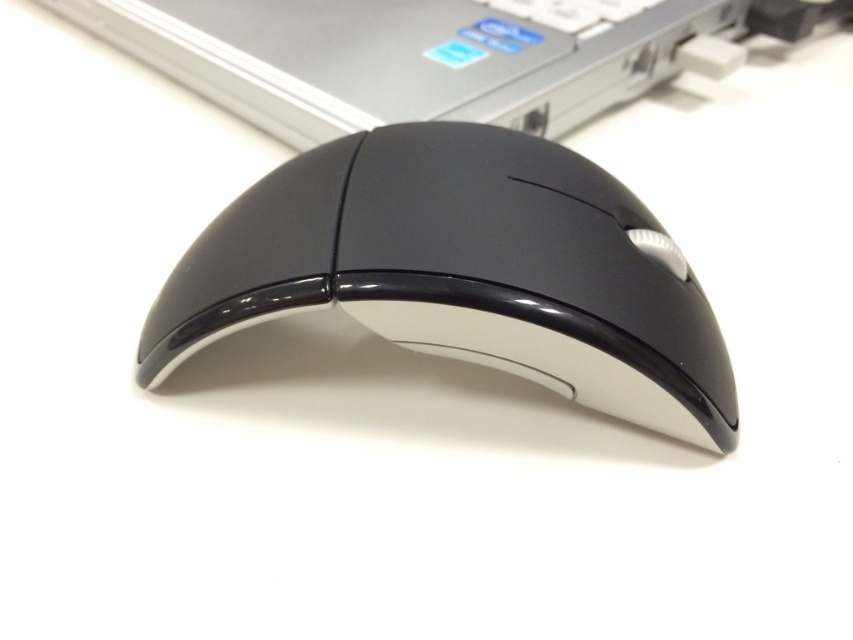
You are a graphic designer working on a project and need to place a new sticker exactly at the center of the white surface where the black glossy mouse at center is currently located. To do this, you must first determine the coordinates of the surface. However, you only have the mouse position. Can you estimate where the center of the white surface is based on the mouse position?

The black glossy mouse at center is located at coordinates point (463,272). Since the mouse is at the center of the white surface, the center of the surface is also at point (463,272).

You are looking at the computer mouse in the image. There are two points marked on it. One is at coordinate point (538, 108) and the other is at point (602, 3). Which point is closer to you?

Point (538, 108) is closer to you than point (602, 3).

You are setting up a workstation and need to place the black glossy mouse at center and the satin silver keyboard at upper center. The desk has limited space. What is the minimum distance required between the two to accommodate both items?

The minimum distance required between the black glossy mouse at center and the satin silver keyboard at upper center should be at least 21.46 inches to accommodate both items properly.